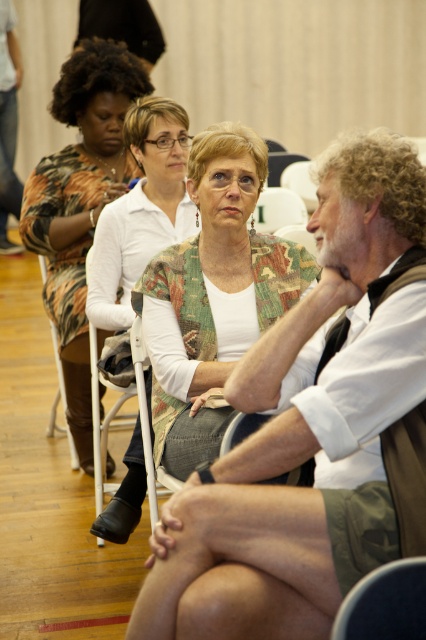
You are organizing a photo shoot and need to ensure that the white shirt at center and the printed fabric dress at center are positioned side by side. Based on the scene described, which clothing item requires more horizontal space to avoid overcrowding?

The white shirt at center requires more horizontal space because its width surpasses that of the printed fabric dress at center, so positioning them side by side would necessitate accommodating the wider garment first.